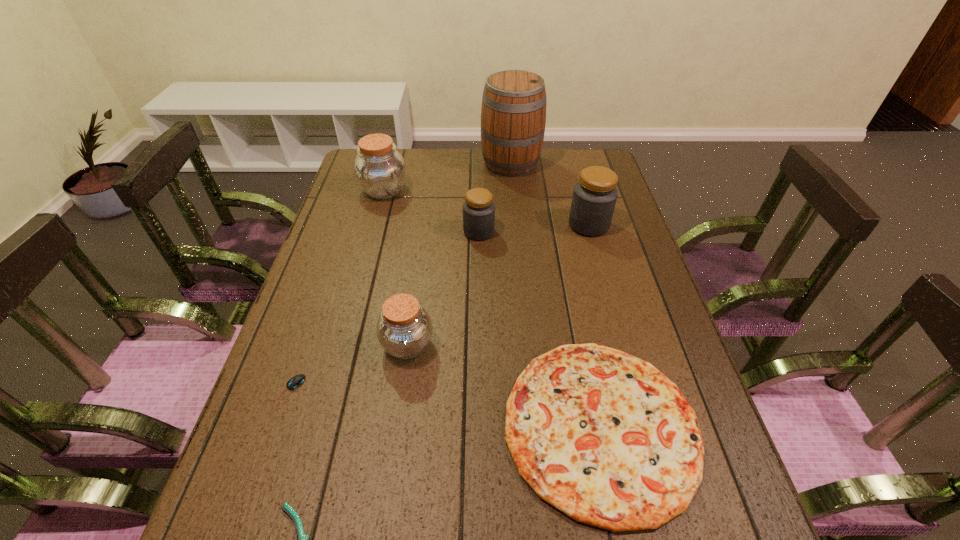
Identify which jar is the closest to the mouse. Please provide its 2D coordinates. Your answer should be formatted as a tuple, i.e. [(x, y)], where the tuple contains the x and y coordinates of a point satisfying the conditions above.

[(404, 329)]

In order to click on the fourth closest jar to the black mouse in this screenshot , I will do `click(594, 198)`.

At what (x,y) coordinates should I click in order to perform the action: click on vacant space that satisfies the following two spatial constraints: 1. on the surface of the bigger gray jar near the warning symbol; 2. on the front side of the sixth tallest object. Please return your answer as a coordinate pair (x, y). This screenshot has width=960, height=540. Looking at the image, I should click on (644, 426).

Where is `free region that satisfies the following two spatial constraints: 1. on the back side of the cider; 2. on the right side of the farthest jar`? free region that satisfies the following two spatial constraints: 1. on the back side of the cider; 2. on the right side of the farthest jar is located at coordinates (392, 164).

I want to click on free space that satisfies the following two spatial constraints: 1. on the back side of the black mouse; 2. on the left side of the farther brown jar, so click(x=355, y=191).